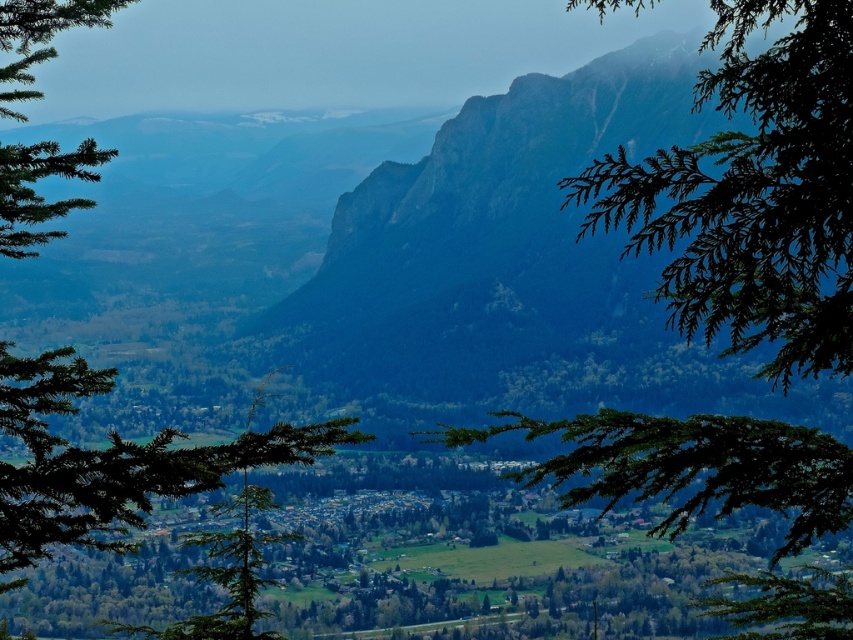
Question: Based on their relative distances, which object is farther from the green matte tree at center?

Choices:
 (A) green leafy branch at upper right
 (B) green leafy branch at center

Answer: (A)

Question: Is the position of green leafy branch at center less distant than that of green matte tree at center?

Choices:
 (A) no
 (B) yes

Answer: (B)

Question: Can you confirm if green leafy branch at center is positioned below green leafy branch at upper right?

Choices:
 (A) no
 (B) yes

Answer: (B)

Question: Which point appears closest to the camera in this image?

Choices:
 (A) coord(9,228)
 (B) coord(724,608)

Answer: (A)

Question: Can you confirm if green leafy branch at center is positioned to the right of green leafy branch at upper right?

Choices:
 (A) yes
 (B) no

Answer: (B)

Question: Which point is closer to the camera?

Choices:
 (A) (55, 157)
 (B) (758, 333)

Answer: (A)